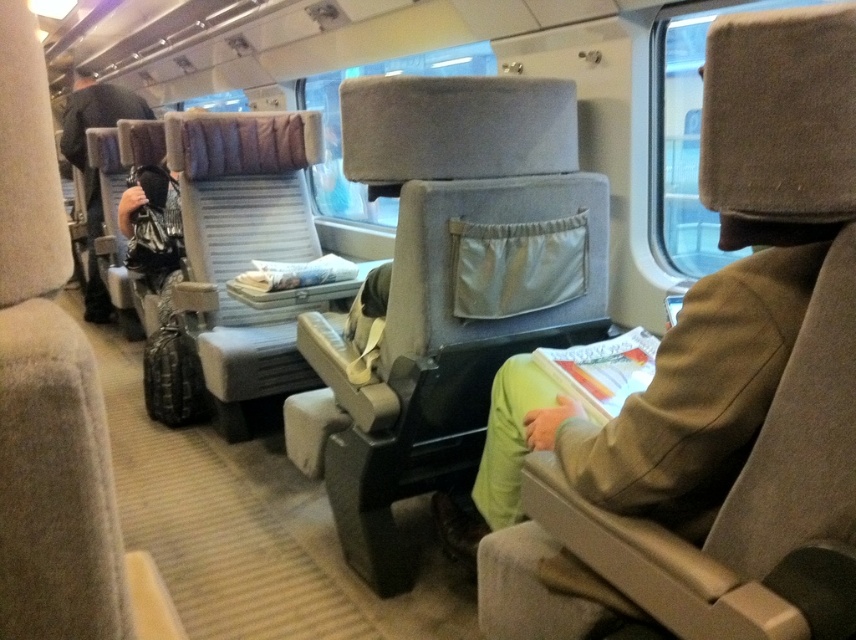
Question: Which object appears closest to the camera in this image?

Choices:
 (A) light gray fabric chair at center
 (B) gray fabric chair at center

Answer: (B)

Question: Observing the image, what is the correct spatial positioning of gray fabric chair at center in reference to matte black backpack at left?

Choices:
 (A) left
 (B) right

Answer: (B)

Question: Which object is farther from the camera taking this photo?

Choices:
 (A) light gray fabric chair at center
 (B) matte gray chair at center
 (C) gray fabric chair at center

Answer: (A)

Question: Where is light brown fabric jacket at center located in relation to matte black backpack at left in the image?

Choices:
 (A) above
 (B) below

Answer: (B)

Question: Can you confirm if gray fabric chair at center is positioned below light gray fabric chair at center?

Choices:
 (A) no
 (B) yes

Answer: (B)

Question: Which object is closer to the camera taking this photo?

Choices:
 (A) light brown fabric jacket at center
 (B) matte black backpack at left
 (C) gray fabric chair at center
 (D) matte gray seat at center

Answer: (D)